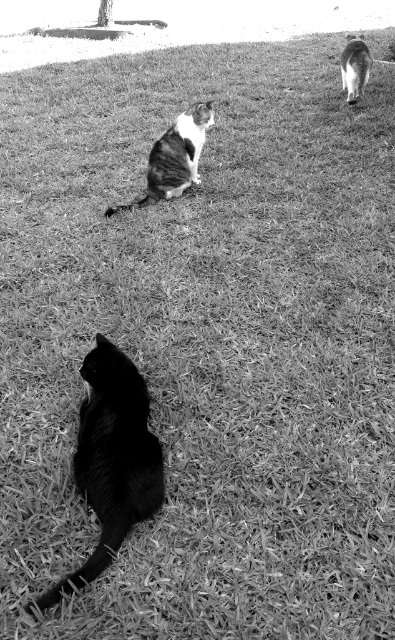
Is black fur cat at lower left above striped fur cat at center?

No, black fur cat at lower left is not above striped fur cat at center.

Is point (131, 476) farther from viewer compared to point (150, 196)?

No.

This screenshot has width=395, height=640. Identify the location of black fur cat at lower left. (112, 458).

Identify the location of black fur cat at lower left. This screenshot has height=640, width=395. (112, 458).

The width and height of the screenshot is (395, 640). What do you see at coordinates (112, 458) in the screenshot?
I see `black fur cat at lower left` at bounding box center [112, 458].

Between black fur cat at lower left and soft fur cat at upper right, which one appears on the right side from the viewer's perspective?

soft fur cat at upper right

Is point (92, 403) positioned after point (359, 80)?

No, (92, 403) is in front of (359, 80).

Locate an element on the screen. The height and width of the screenshot is (640, 395). black fur cat at lower left is located at coordinates pos(112,458).

Does striped fur cat at center appear on the left side of soft fur cat at upper right?

Correct, you'll find striped fur cat at center to the left of soft fur cat at upper right.

Which is more to the left, striped fur cat at center or soft fur cat at upper right?

Positioned to the left is striped fur cat at center.

What do you see at coordinates (174, 157) in the screenshot? Image resolution: width=395 pixels, height=640 pixels. I see `striped fur cat at center` at bounding box center [174, 157].

I want to click on striped fur cat at center, so click(x=174, y=157).